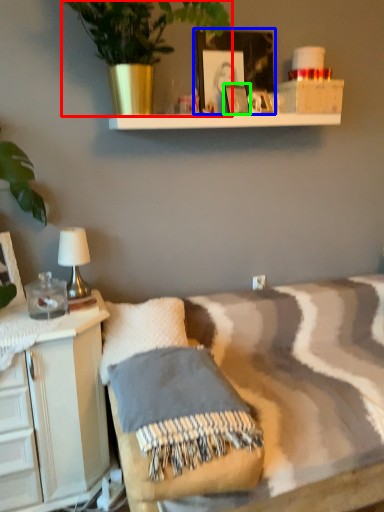
Question: Considering the real-world distances, which object is closest to houseplant (highlighted by a red box)? picture frame (highlighted by a blue box) or picture frame (highlighted by a green box).

Choices:
 (A) picture frame
 (B) picture frame

Answer: (A)